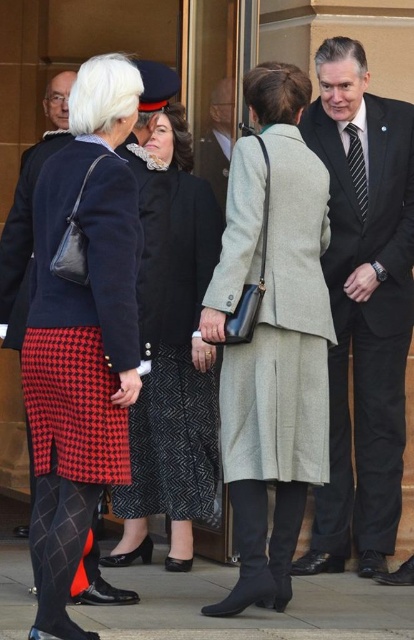
Based on the scene description, can you determine the spatial relationship between the houndstooth skirt at center and the other objects mentioned in the foreground?

The houndstooth skirt at center is positioned at point coordinates (x=175, y=374), but without specific coordinates for the other foreground objects, it is not possible to determine their exact spatial relationship to it.

Looking at the two items at the center of the image, the houndstooth skirt at center and the striped silk tie at center, which one is positioned lower?

The houndstooth skirt at center is positioned lower than the striped silk tie at center.

You are attending a formal event and need to locate two specific attendees based on their attire. The first person is wearing a houndstooth skirt at left, and the second is dressed in a dark gray suit at center. From the perspective of someone facing the group, which individual is positioned to the right?

The dark gray suit at center is positioned to the right of the houndstooth skirt at left.